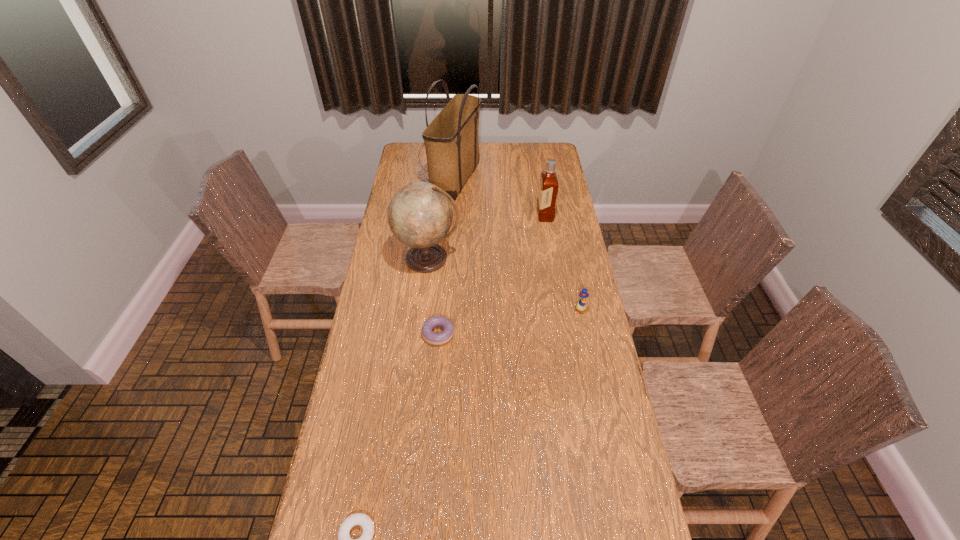
Locate an element on the screen. This screenshot has width=960, height=540. the tallest object is located at coordinates (451, 140).

Where is `tote bag`? Image resolution: width=960 pixels, height=540 pixels. tote bag is located at coordinates (451, 140).

Locate an element on the screen. the third farthest object is located at coordinates click(420, 214).

What are the coordinates of `globe` in the screenshot? It's located at (420, 214).

You are a GUI agent. You are given a task and a screenshot of the screen. Output one action in this format:
    pyautogui.click(x=<x>, y=<y>)
    Task: Click on the second farthest object
    The image size is (960, 540).
    Given the screenshot: What is the action you would take?
    pyautogui.click(x=548, y=189)

Where is `liquor`? The image size is (960, 540). liquor is located at coordinates (548, 189).

Locate an element on the screen. The height and width of the screenshot is (540, 960). duckling is located at coordinates (581, 305).

Identify the location of the third nearest object. This screenshot has width=960, height=540. (581, 305).

This screenshot has height=540, width=960. In order to click on the fifth tallest object in this screenshot , I will do `click(429, 336)`.

Locate an element on the screen. The height and width of the screenshot is (540, 960). the taller doughnut is located at coordinates coord(429,336).